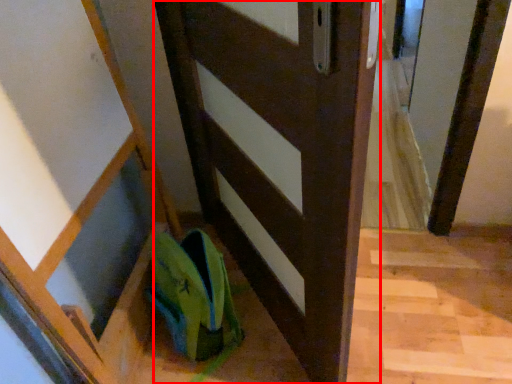
Question: From the image's perspective, considering the relative positions of door (annotated by the red box) and shoe in the image provided, where is door (annotated by the red box) located with respect to the staircase?

Choices:
 (A) below
 (B) above

Answer: (B)